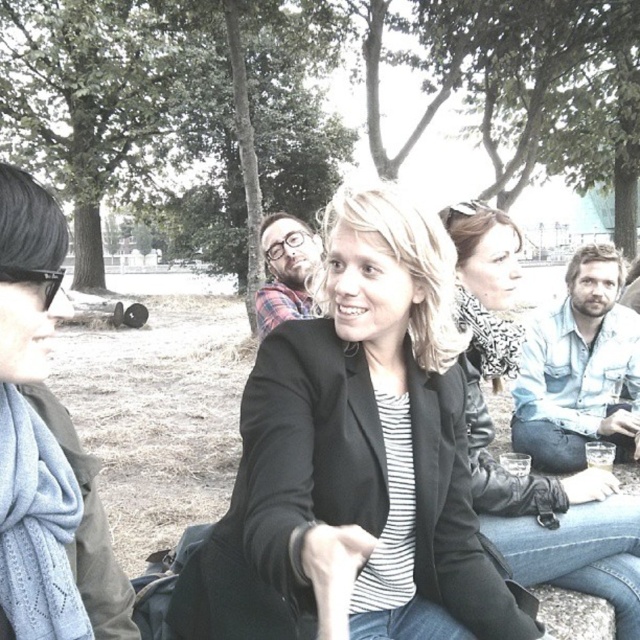
Who is positioned more to the right, black matte blazer at center or light blue knitted scarf at left?

black matte blazer at center

Does black matte blazer at center have a lesser width compared to light blue knitted scarf at left?

In fact, black matte blazer at center might be wider than light blue knitted scarf at left.

Locate an element on the screen. This screenshot has width=640, height=640. black matte blazer at center is located at coordinates (355, 458).

How much distance is there between black matte blazer at center and light blue scarf at center?

A distance of 20.19 inches exists between black matte blazer at center and light blue scarf at center.

Is black matte blazer at center taller than light blue scarf at center?

Incorrect, black matte blazer at center's height is not larger of light blue scarf at center's.

Between point (449, 612) and point (497, 212), which one is positioned behind?

Positioned behind is point (497, 212).

Where is `black matte blazer at center`? black matte blazer at center is located at coordinates (355, 458).

Is light blue scarf at center positioned behind light blue knitted scarf at left?

Yes, it is behind light blue knitted scarf at left.

Describe the element at coordinates (532, 474) in the screenshot. I see `light blue scarf at center` at that location.

Does point (481, 285) lie in front of point (116, 600)?

No, it is not.

This screenshot has width=640, height=640. I want to click on light blue scarf at center, so click(532, 474).